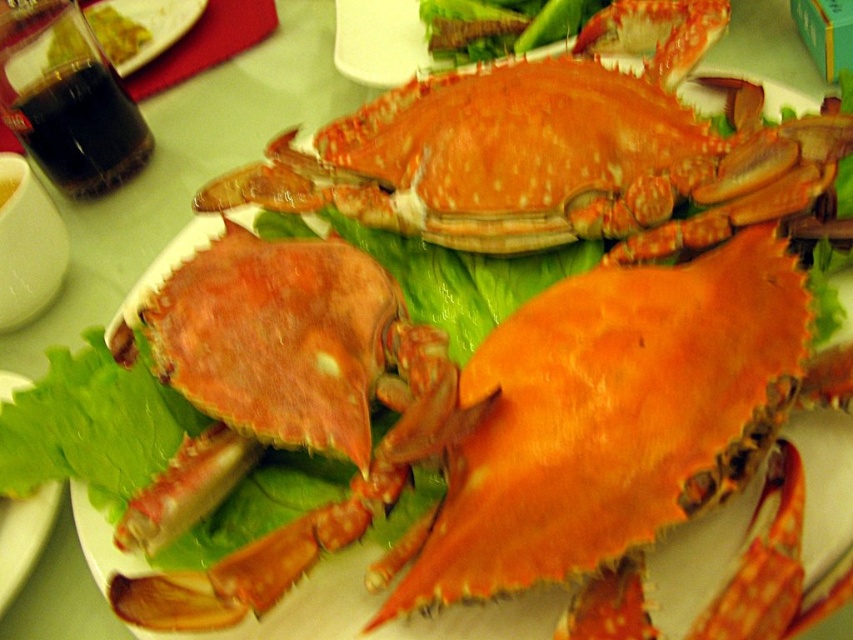
Question: In this image, where is orange matte crab at center located relative to yellow-green sauce at upper left?

Choices:
 (A) below
 (B) above

Answer: (A)

Question: Which object is farther from the camera taking this photo?

Choices:
 (A) yellow-green sauce at upper left
 (B) orange matte crab at center
 (C) green leafy lettuce at lower left
 (D) shiny orange crab at center

Answer: (A)

Question: Is shiny orange crab at center positioned before green leafy lettuce at lower left?

Choices:
 (A) yes
 (B) no

Answer: (A)

Question: Which of the following is the closest to the observer?

Choices:
 (A) (705, 200)
 (B) (136, 28)

Answer: (A)

Question: Which object is positioned closest to the shiny orange crab at center?

Choices:
 (A) orange matte crab at center
 (B) green leafy lettuce at lower left

Answer: (A)

Question: Is green leafy lettuce at lower left thinner than yellow-green sauce at upper left?

Choices:
 (A) yes
 (B) no

Answer: (A)